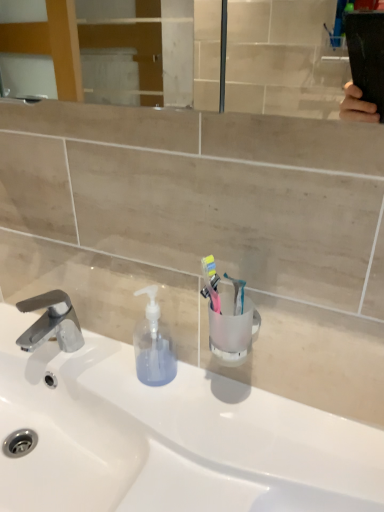
Where is `vacant space that is to the left of transparent plastic soap dispenser at center`? This screenshot has height=512, width=384. vacant space that is to the left of transparent plastic soap dispenser at center is located at coordinates (96, 366).